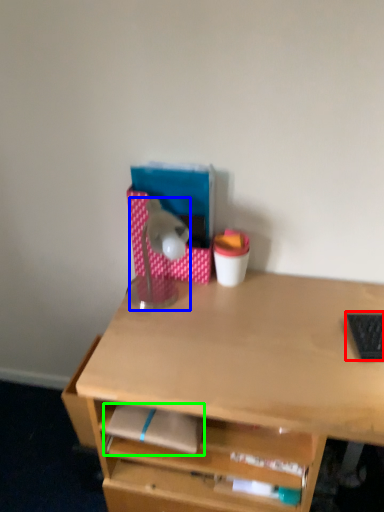
Question: Estimate the real-world distances between objects in this image. Which object is farther from laptop keyboard (highlighted by a red box), lamp (highlighted by a blue box) or notepad (highlighted by a green box)?

Choices:
 (A) lamp
 (B) notepad

Answer: (A)